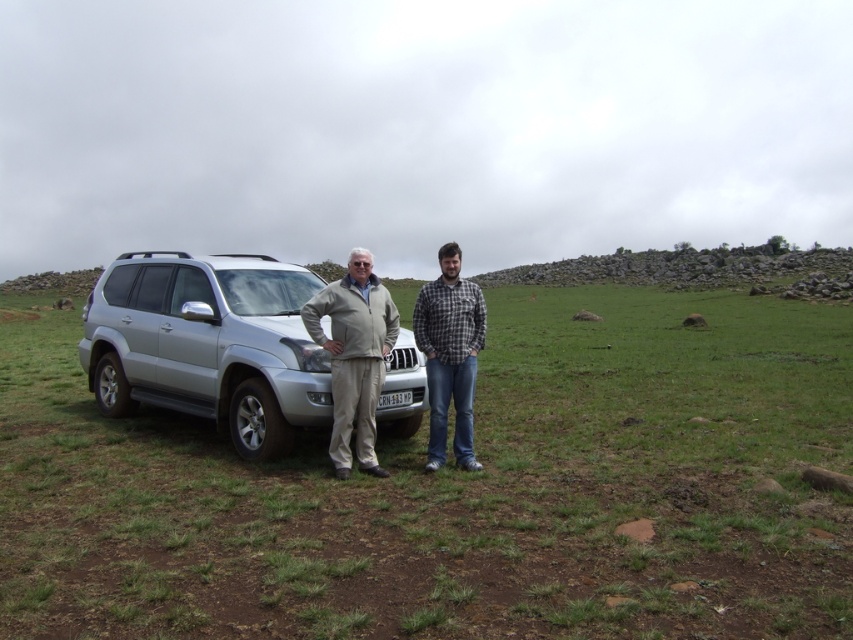
You are standing in a grassy field and want to place a small flag at the point closer to you between the two points marked as point (410, 432) and point (427, 355). Which point should you choose?

You should choose point (410, 432) because it is closer to you than point (427, 355).

You are a photographer setting up a shot in the scene described. You want to ensure that both the green grassy field at center and the plaid flannel shirt at center are clearly visible in the frame. Given their sizes, which object should you focus on to ensure both are in focus?

The green grassy field at center has a larger size compared to plaid flannel shirt at center. To ensure both are in focus, you should focus on the plaid flannel shirt at center since it is smaller and closer to the camera, allowing the larger field to remain in the background focus range.